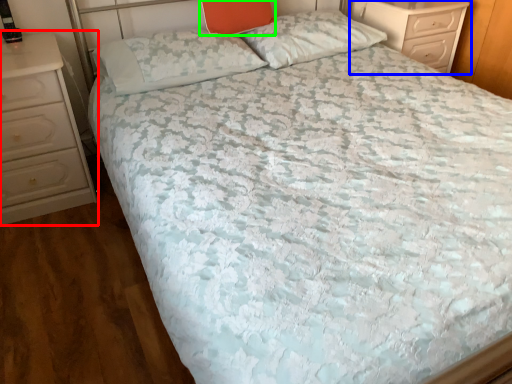
Question: Which is nearer to the chest of drawers (highlighted by a red box)? chest of drawers (highlighted by a blue box) or pillow (highlighted by a green box).

Choices:
 (A) chest of drawers
 (B) pillow

Answer: (B)